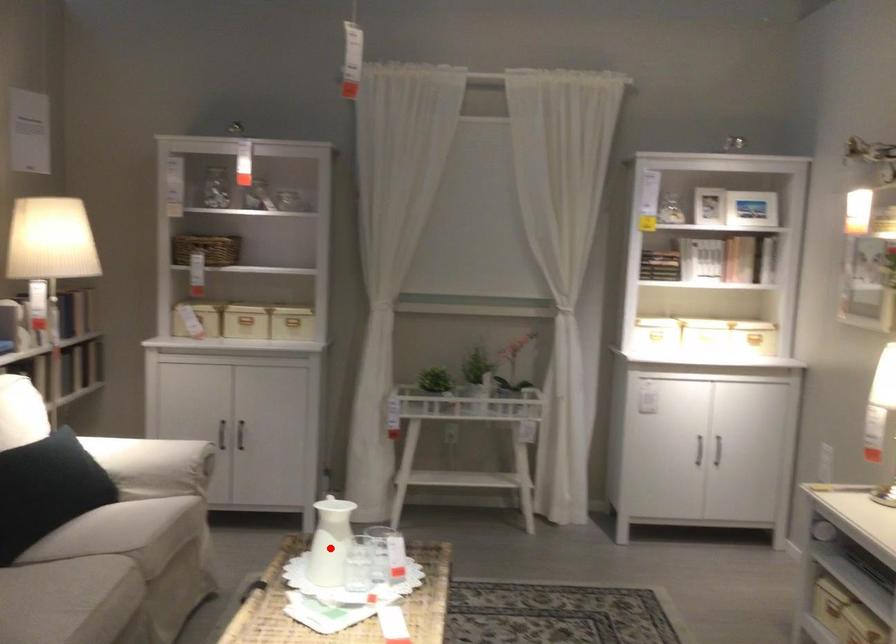
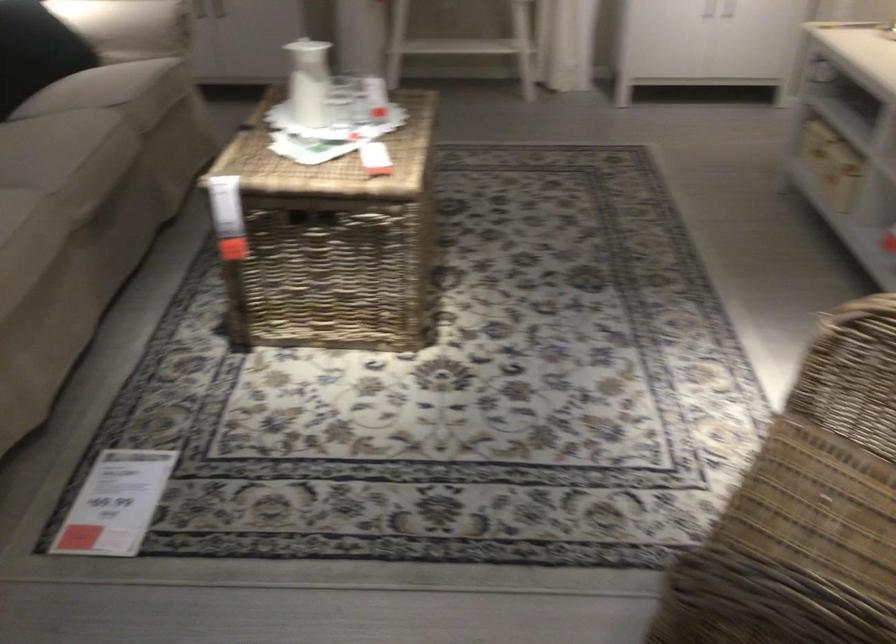
The point at the highlighted location is marked in the first image. Where is the corresponding point in the second image?

(308, 82)